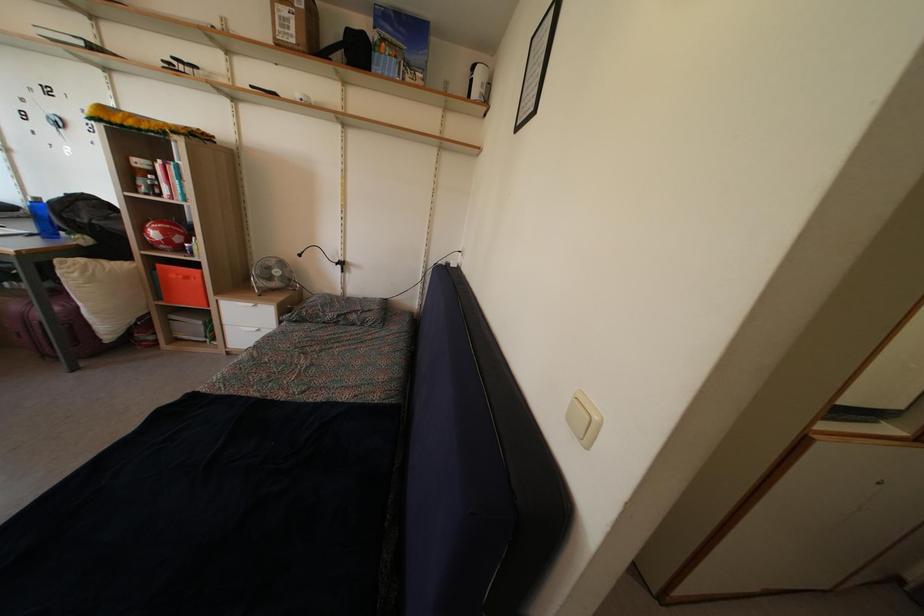
The height and width of the screenshot is (616, 924). I want to click on yellow feather duster, so click(x=141, y=123).